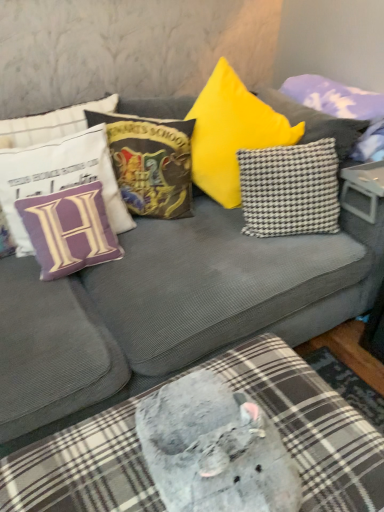
Question: In terms of height, does plush gray cushion at lower center look taller or shorter compared to purple fabric pillow at left, the fourth pillow when ordered from right to left?

Choices:
 (A) short
 (B) tall

Answer: (B)

Question: In terms of width, does plush gray cushion at lower center look wider or thinner when compared to purple fabric pillow at left, the fourth pillow when ordered from right to left?

Choices:
 (A) thin
 (B) wide

Answer: (B)

Question: Estimate the real-world distances between objects in this image. Which object is farther from the checkered fabric pillow at upper right, acting as the 1th pillow starting from the right?

Choices:
 (A) velvet hogwarts school of witchcraft and wizardry pillow at upper center, which is counted as the third pillow, starting from the right
 (B) white fabric pillow with purple letter h at upper left, which appears as the fifth pillow when viewed from the right
 (C) purple fabric pillow at left, the fourth pillow when ordered from right to left
 (D) plastic gray table at center
 (E) black-and-white checkered pillow at center-right, positioned as the 2th pillow in right-to-left order

Answer: (C)

Question: Which object is the closest to the black-and-white checkered pillow at center-right, positioned as the 2th pillow in right-to-left order?

Choices:
 (A) velvet hogwarts school of witchcraft and wizardry pillow at upper center, which ranks as the third pillow in left-to-right order
 (B) plush gray cushion at lower center
 (C) plastic gray table at center
 (D) checkered fabric pillow at upper right, acting as the 1th pillow starting from the right
 (E) white fabric pillow with purple letter h at upper left, which appears as the fifth pillow when viewed from the right

Answer: (C)